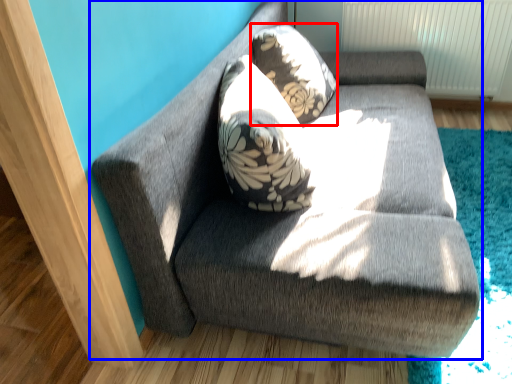
Question: Which object appears farthest to the camera in this image, throw pillow (highlighted by a red box) or studio couch (highlighted by a blue box)?

Choices:
 (A) throw pillow
 (B) studio couch

Answer: (A)